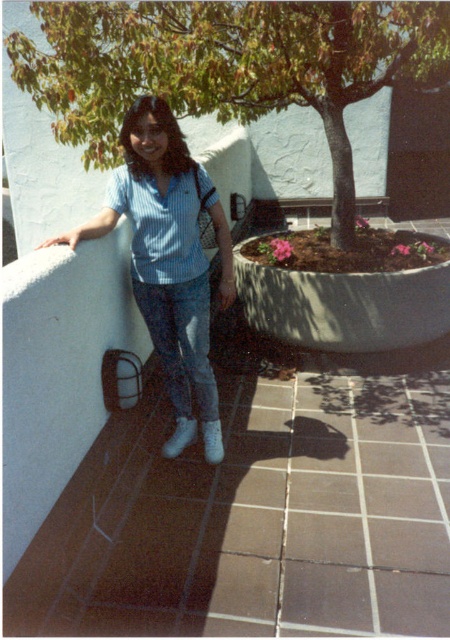
Is green leafy tree at center closer to camera compared to denim jeans at center?

No, green leafy tree at center is behind denim jeans at center.

Is point (172, 102) positioned behind point (157, 330)?

Yes.

This screenshot has height=640, width=450. I want to click on green leafy tree at center, so click(225, 67).

Who is positioned more to the left, green leafy tree at center or blue striped shirt at upper left?

blue striped shirt at upper left is more to the left.

Who is positioned more to the right, green leafy tree at center or blue striped shirt at upper left?

Positioned to the right is green leafy tree at center.

Where is `green leafy tree at center`? This screenshot has width=450, height=640. green leafy tree at center is located at coordinates (225, 67).

Image resolution: width=450 pixels, height=640 pixels. I want to click on green leafy tree at center, so click(225, 67).

Does blue striped shirt at upper left have a larger size compared to denim jeans at center?

Correct, blue striped shirt at upper left is larger in size than denim jeans at center.

Describe the element at coordinates (169, 260) in the screenshot. I see `blue striped shirt at upper left` at that location.

This screenshot has width=450, height=640. What do you see at coordinates (169, 260) in the screenshot?
I see `blue striped shirt at upper left` at bounding box center [169, 260].

This screenshot has width=450, height=640. What are the coordinates of `blue striped shirt at upper left` in the screenshot? It's located at (169, 260).